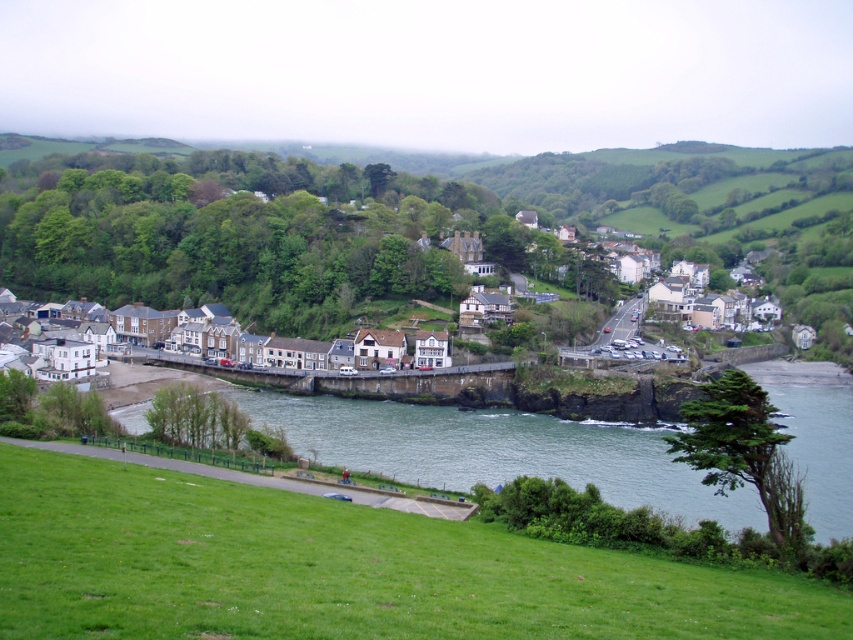
In the scene shown: Is green grassy at lower left above greenish-blue water at lower center?

No.

Is point (90, 564) positioned after point (421, 413)?

That is False.

Where is `green grassy at lower left`? green grassy at lower left is located at coordinates (340, 568).